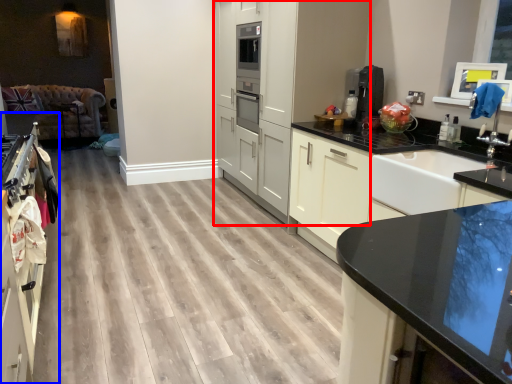
Question: Which object appears farthest to the camera in this image, cabinetry (highlighted by a red box) or cabinetry (highlighted by a blue box)?

Choices:
 (A) cabinetry
 (B) cabinetry

Answer: (A)